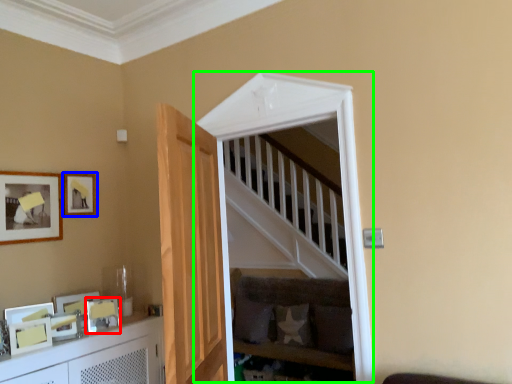
Question: Which object is positioned farthest from picture frame (highlighted by a red box)? Select from picture frame (highlighted by a blue box) and window (highlighted by a green box).

Choices:
 (A) picture frame
 (B) window

Answer: (B)